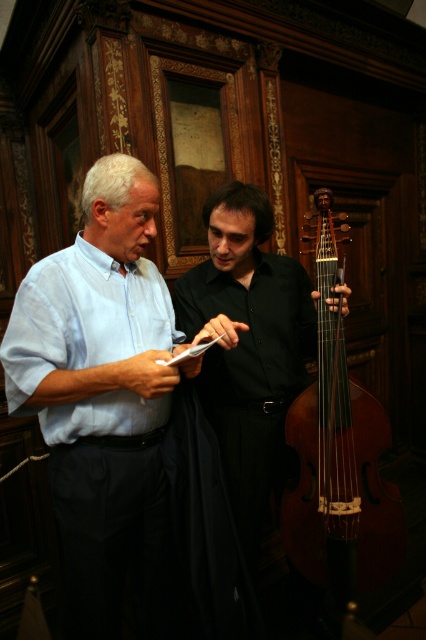
You are standing in the room and want to place a small decorative item exactly halfway between the two points labeled point (218, 440) and point (336, 448). Will the item be closer to the camera or further away from it compared to the average depth of the two points?

The item will be closer to the camera than the average depth of the two points because point (218, 440) is closer to the camera than point (336, 448), so the midpoint would lean towards the closer point.

You are a photographer positioned at the entrance of the room. You need to take a photo that includes both the light blue cotton shirt at center and the black smooth shirt at center. Which person should be placed on the left side of the photo to ensure both are visible?

The light blue cotton shirt at center should be placed on the left side of the photo because it is already positioned to the left of the black smooth shirt at center in the scene.